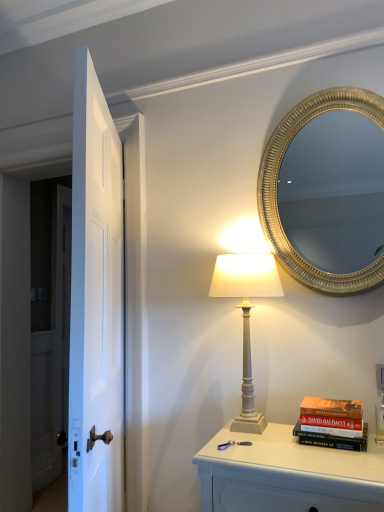
Question: Can you confirm if white matte table lamp at center is shorter than white glossy door at left?

Choices:
 (A) yes
 (B) no

Answer: (A)

Question: Is white matte table lamp at center far from white glossy door at left?

Choices:
 (A) no
 (B) yes

Answer: (A)

Question: Is white matte table lamp at center aimed at white glossy door at left?

Choices:
 (A) no
 (B) yes

Answer: (A)

Question: Is the surface of white matte table lamp at center in direct contact with white glossy door at left?

Choices:
 (A) no
 (B) yes

Answer: (A)

Question: Could white glossy door at left be considered to be inside white matte table lamp at center?

Choices:
 (A) no
 (B) yes

Answer: (A)

Question: Is white matte table lamp at center spatially inside gold textured mirror at upper right, or outside of it?

Choices:
 (A) inside
 (B) outside

Answer: (B)

Question: In terms of height, does white matte table lamp at center look taller or shorter compared to gold textured mirror at upper right?

Choices:
 (A) short
 (B) tall

Answer: (A)

Question: Considering the positions of white matte table lamp at center and gold textured mirror at upper right in the image, is white matte table lamp at center wider or thinner than gold textured mirror at upper right?

Choices:
 (A) wide
 (B) thin

Answer: (A)

Question: Is white matte table lamp at center bigger or smaller than gold textured mirror at upper right?

Choices:
 (A) small
 (B) big

Answer: (B)

Question: Is white painted wood nightstand at lower right bigger or smaller than white matte table lamp at center?

Choices:
 (A) big
 (B) small

Answer: (A)

Question: Is point (221, 463) closer or farther from the camera than point (228, 266)?

Choices:
 (A) closer
 (B) farther

Answer: (A)

Question: Do you think white painted wood nightstand at lower right is within white matte table lamp at center, or outside of it?

Choices:
 (A) outside
 (B) inside

Answer: (A)

Question: Considering the positions of white painted wood nightstand at lower right and white matte table lamp at center in the image, is white painted wood nightstand at lower right wider or thinner than white matte table lamp at center?

Choices:
 (A) thin
 (B) wide

Answer: (B)

Question: Is white matte table lamp at center taller or shorter than white glossy door at left?

Choices:
 (A) tall
 (B) short

Answer: (B)

Question: Is white matte table lamp at center in front of or behind white glossy door at left in the image?

Choices:
 (A) front
 (B) behind

Answer: (B)